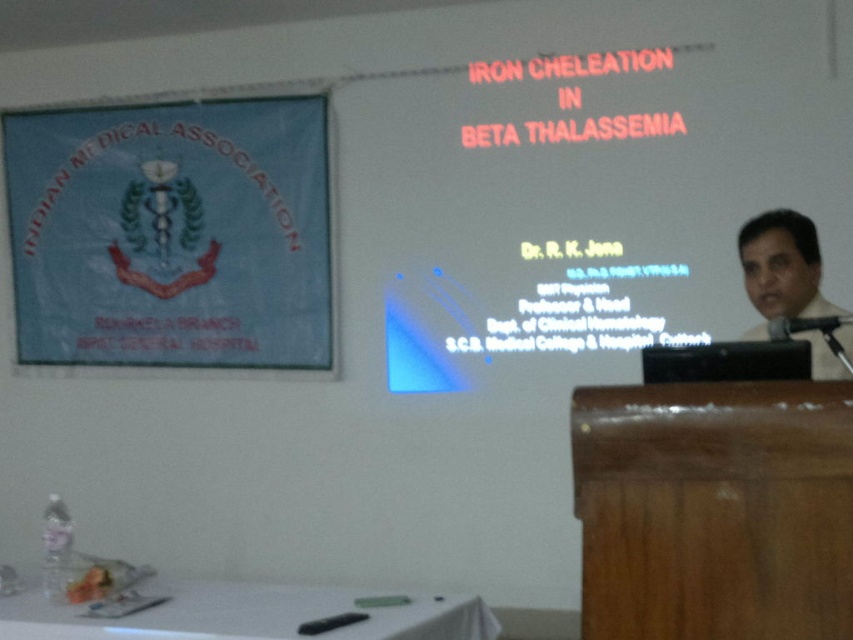
You are an attendee at the presentation and want to take a photo of the dark gray shirt at right and the blue fabric banner at upper left. Which object should you focus on first if you want to capture both in a single frame without moving the camera?

The blue fabric banner at upper left is to the left of dark gray shirt at right, so you should focus on the blue fabric banner at upper left first to ensure both objects are in the frame.

You are organizing an event and need to place a 3 meter long tablecloth on the white plastic table at lower center. The blue fabric banner at upper left is currently covering part of the wall. Do you think the tablecloth will fit on the table if the banner is wider than the table?

The blue fabric banner at upper left might be wider than the white plastic table at lower center, so there is a possibility that the tablecloth designed for 3 meters may not fit perfectly if the table is narrower than the banner. However, without exact measurements of the table, it is uncertain. Consider measuring the table first before placing the tablecloth.

You are a photographer standing at the back of the room. You need to capture a photo that includes both the white plastic table at lower center and the dark gray shirt at right. Given that your camera has a maximum focus range of 4 feet, will you be able to include both objects in the same frame without moving closer?

The white plastic table at lower center and dark gray shirt at right are 4.50 feet apart from each other. Since the distance between them exceeds the camera maximum focus range of 4 feet, you will not be able to include both objects in the same frame without moving closer.